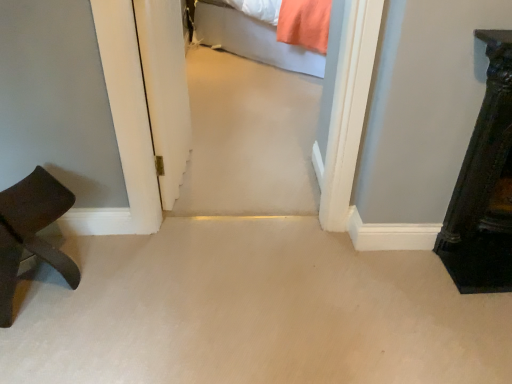
I want to click on vacant area in front of dark brown wood stool at left, the 1th furniture positioned from the left, so click(x=42, y=344).